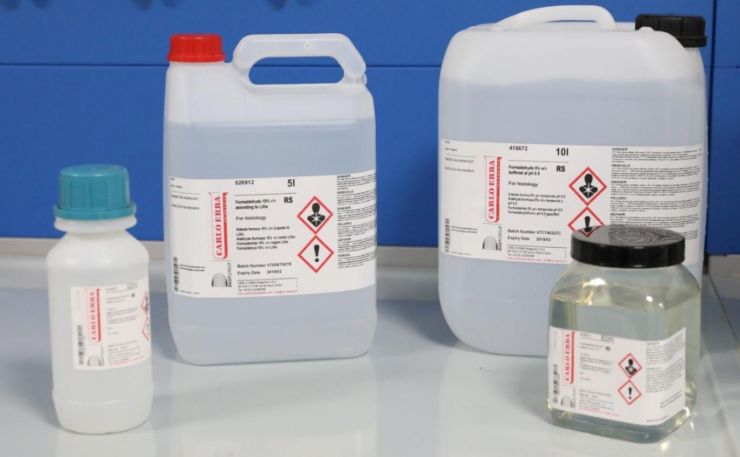
Where is `blue board on wall`? This screenshot has height=457, width=740. blue board on wall is located at coordinates (98, 142).